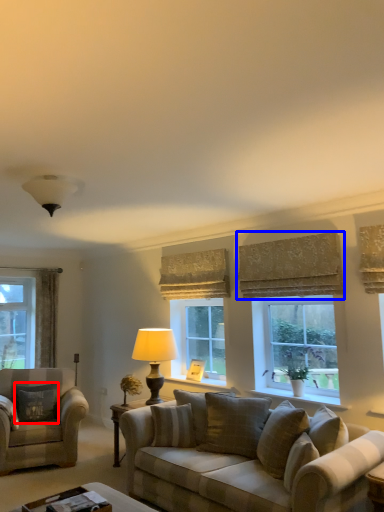
Question: Which of the following is the farthest to the observer, pillow (highlighted by a red box) or curtain (highlighted by a blue box)?

Choices:
 (A) pillow
 (B) curtain

Answer: (A)